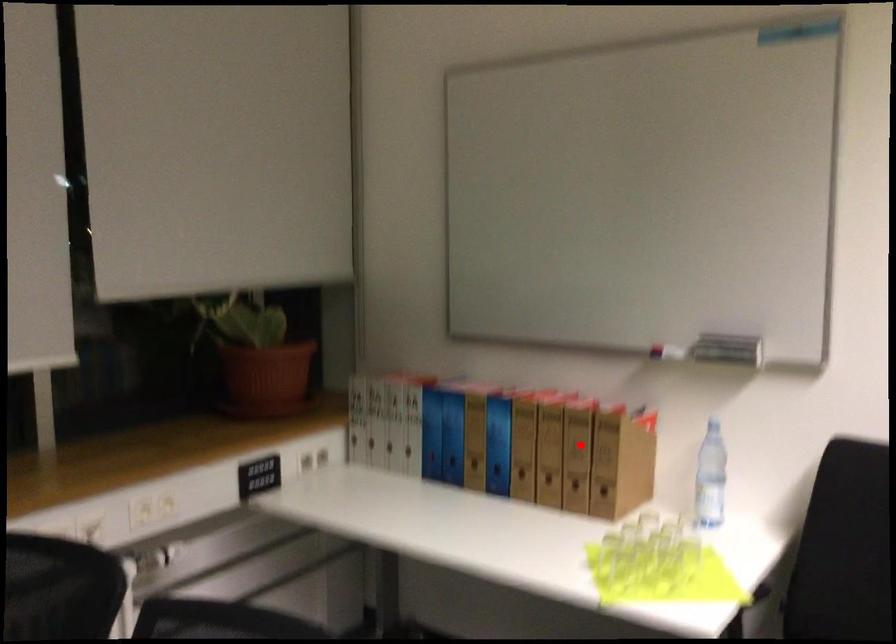
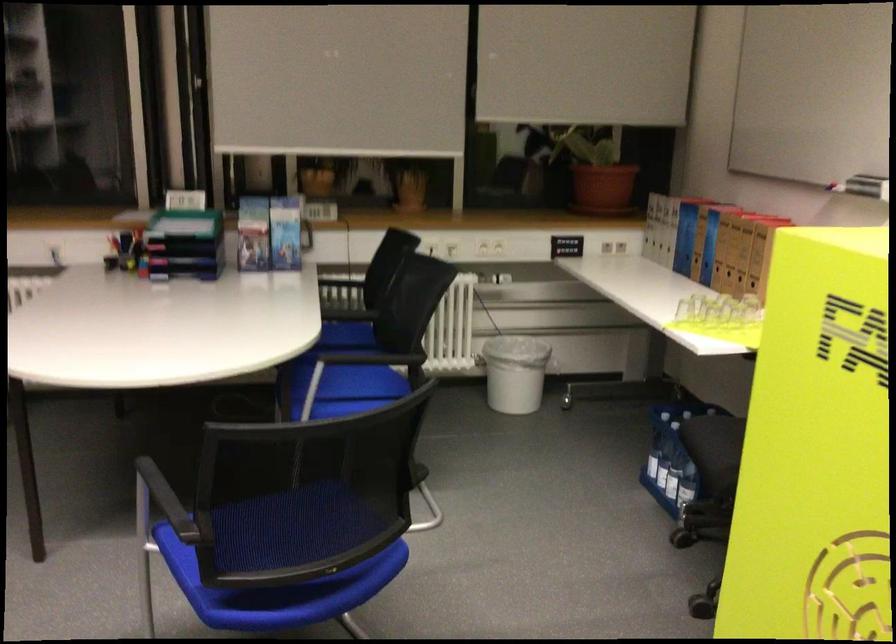
In the second image, find the point that corresponds to the highlighted location in the first image.

(746, 243)